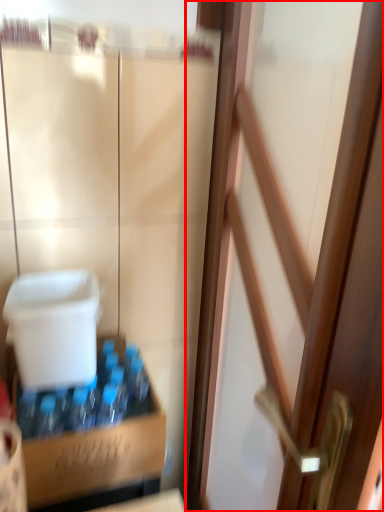
Question: Considering the relative positions of door (annotated by the red box) and cardboard box in the image provided, where is door (annotated by the red box) located with respect to the staircase?

Choices:
 (A) right
 (B) left

Answer: (A)